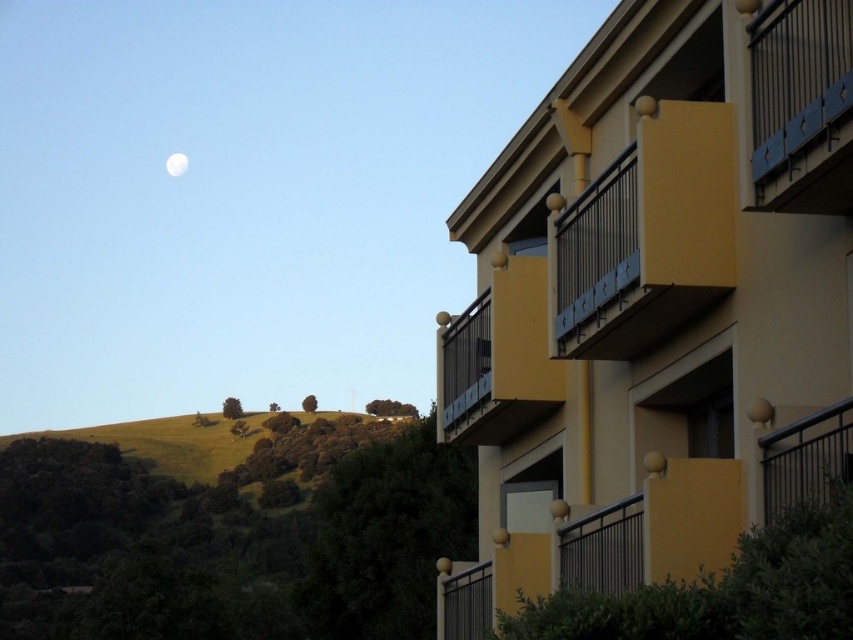
Can you confirm if matte yellow balcony at upper right is positioned to the left of blue painted metal railing at upper right?

Correct, you'll find matte yellow balcony at upper right to the left of blue painted metal railing at upper right.

Who is more distant from viewer, (585,211) or (808,76)?

Positioned behind is point (585,211).

Where is `matte yellow balcony at upper right`? matte yellow balcony at upper right is located at coordinates (647, 236).

Does blue painted metal railing at upper right lie in front of white glossy moon at upper left?

That is True.

Is point (839, 154) closer to viewer compared to point (178, 152)?

Yes, it is.

Identify the location of blue painted metal railing at upper right. The width and height of the screenshot is (853, 640). (801, 106).

Is matte yellow balcony at upper right below white glossy moon at upper left?

Indeed, matte yellow balcony at upper right is positioned under white glossy moon at upper left.

Can you confirm if matte yellow balcony at upper right is positioned above white glossy moon at upper left?

No, matte yellow balcony at upper right is not above white glossy moon at upper left.

Who is more distant from viewer, (596,260) or (175,157)?

Positioned behind is point (175,157).

The width and height of the screenshot is (853, 640). Identify the location of matte yellow balcony at upper right. (647, 236).